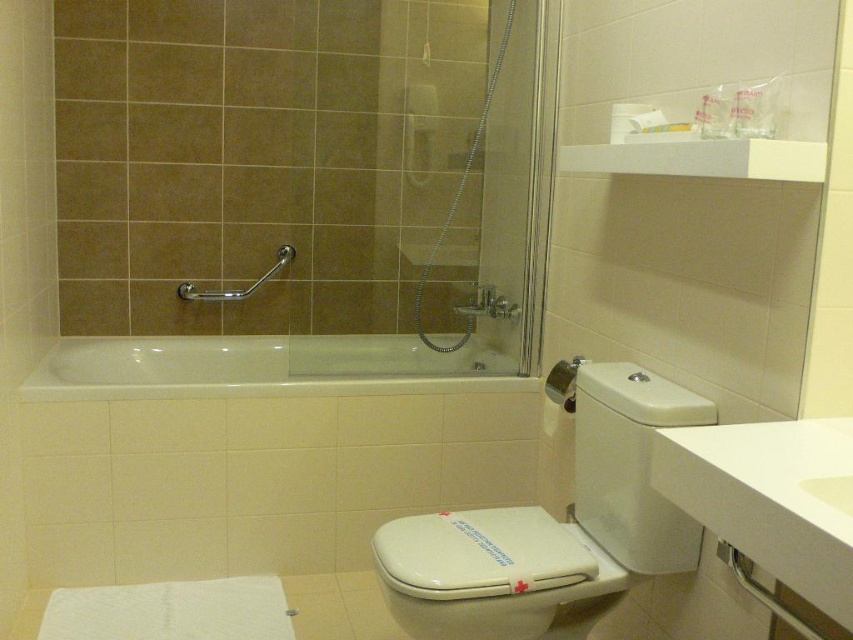
Who is more forward, (761, 540) or (247, 289)?

Positioned in front is point (761, 540).

Which is above, white glossy sink at lower right or satin nickel grab bar at upper left?

satin nickel grab bar at upper left

Which is behind, point (790, 577) or point (250, 284)?

The point (250, 284) is more distant.

The height and width of the screenshot is (640, 853). In order to click on white glossy sink at lower right in this screenshot , I will do `click(770, 499)`.

Consider the image. Which of these two, white glossy bathtub at center or satin nickel grab bar at upper left, stands shorter?

white glossy bathtub at center is shorter.

Is point (358, 368) closer to camera compared to point (215, 296)?

No, it is not.

Identify the location of white glossy bathtub at center. (248, 369).

Is white glossy sink at lower right bigger than white glossy bathtub at center?

No, white glossy sink at lower right is not bigger than white glossy bathtub at center.

Between white glossy sink at lower right and white glossy bathtub at center, which one has more height?

With more height is white glossy sink at lower right.

Where is `white glossy sink at lower right`? This screenshot has height=640, width=853. white glossy sink at lower right is located at coordinates (770, 499).